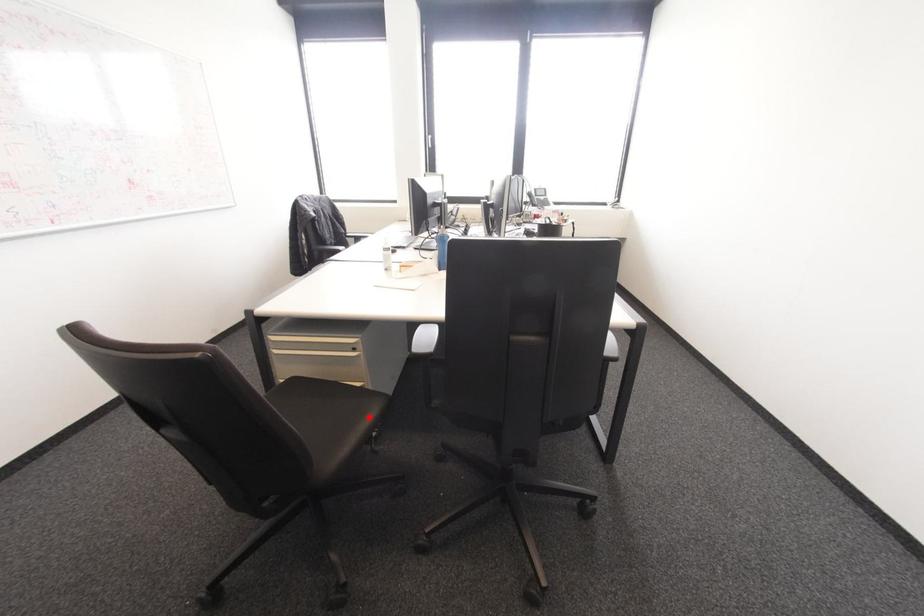
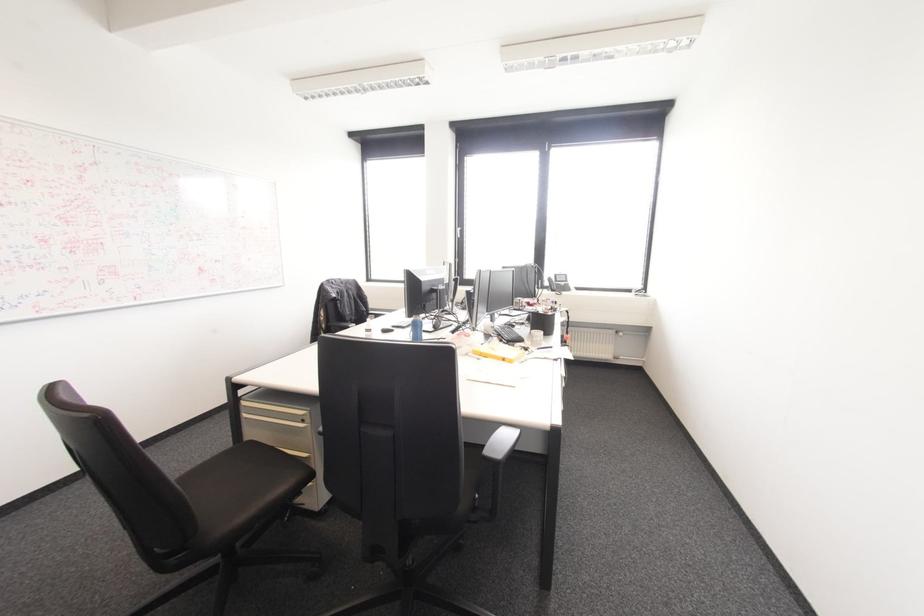
Locate, in the second image, the point that corresponds to the highlighted location in the first image.

(281, 488)